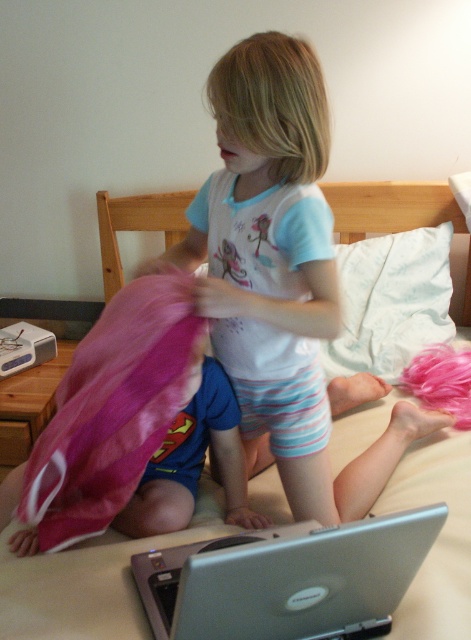
Looking at this image, does white soft bed at center have a lesser width compared to pink fabric at left?

No, white soft bed at center is not thinner than pink fabric at left.

Is the position of white soft bed at center more distant than that of pink fabric at left?

No.

Locate an element on the screen. The image size is (471, 640). white soft bed at center is located at coordinates (72, 595).

Locate an element on the screen. This screenshot has width=471, height=640. white soft bed at center is located at coordinates (72, 595).

Does white soft bed at center appear under silver metallic laptop at lower center?

No, white soft bed at center is not below silver metallic laptop at lower center.

You are a GUI agent. You are given a task and a screenshot of the screen. Output one action in this format:
    pyautogui.click(x=<x>, y=<y>)
    Task: Click on the white soft bed at center
    Image resolution: width=471 pixels, height=640 pixels.
    Given the screenshot: What is the action you would take?
    pyautogui.click(x=72, y=595)

I want to click on white soft bed at center, so click(72, 595).

Is white soft bed at center smaller than white soft pillow at upper center?

No, white soft bed at center is not smaller than white soft pillow at upper center.

This screenshot has height=640, width=471. Describe the element at coordinates (72, 595) in the screenshot. I see `white soft bed at center` at that location.

Find the location of a particular element. This screenshot has height=640, width=471. white soft bed at center is located at coordinates (72, 595).